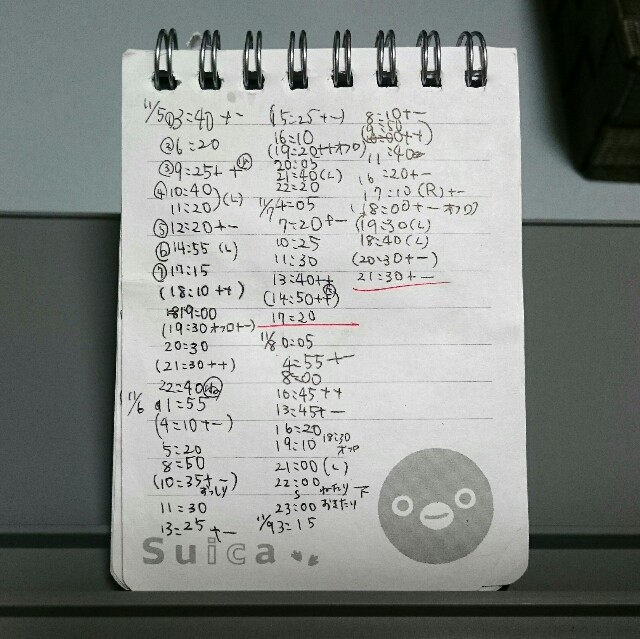
Where is `ring binder`? ring binder is located at coordinates (160, 80), (211, 80), (244, 82), (312, 71), (346, 73), (371, 73), (429, 71), (472, 78).